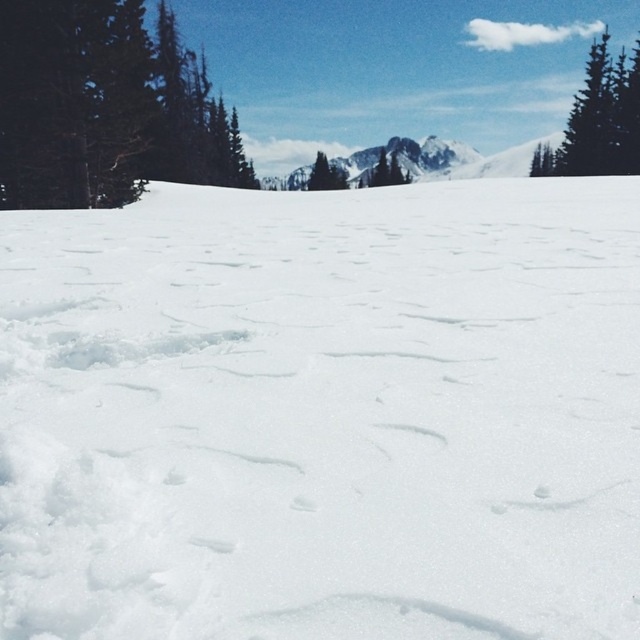
Is point (323, 605) positioned in front of point (369, 170)?

That is True.

Where is `white fluffy snow at center`? The image size is (640, 640). white fluffy snow at center is located at coordinates (323, 413).

Which is in front, point (604, 90) or point (438, 164)?

Point (604, 90) is more forward.

Who is more distant from viewer, (598,108) or (396,156)?

Point (396,156)

Which is in front, point (637, 49) or point (336, 161)?

Point (637, 49)

This screenshot has height=640, width=640. I want to click on green textured pine tree at upper right, so click(x=598, y=120).

Is white fluffy snow at center taller than green matte tree at upper left?

Incorrect, white fluffy snow at center's height is not larger of green matte tree at upper left's.

Is white fluffy snow at center closer to camera compared to green matte tree at upper left?

Yes, it is in front of green matte tree at upper left.

This screenshot has height=640, width=640. Find the location of `white fluffy snow at center`. white fluffy snow at center is located at coordinates (323, 413).